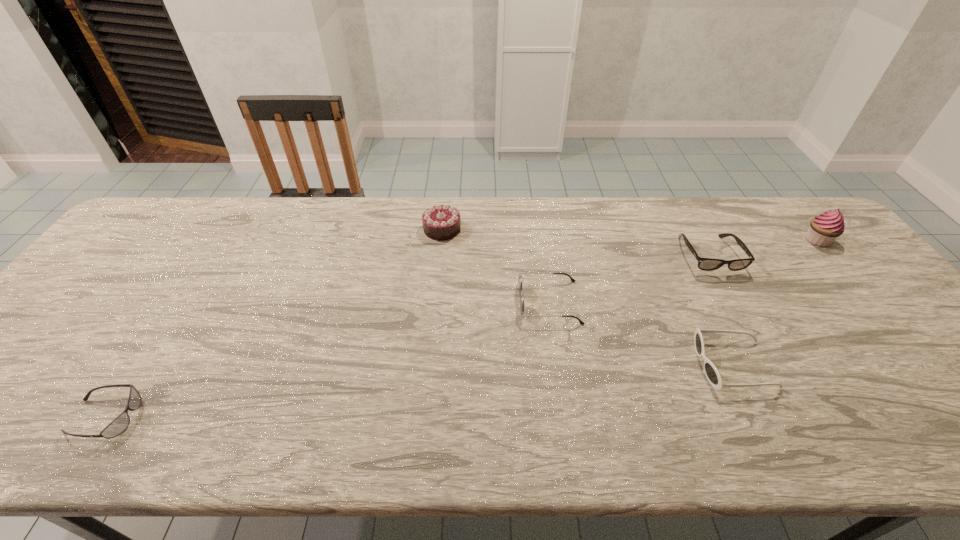
The width and height of the screenshot is (960, 540). In order to click on cupcake in this screenshot , I will do `click(824, 229)`.

What are the coordinates of `the tallest object` in the screenshot? It's located at (824, 229).

The width and height of the screenshot is (960, 540). Identify the location of the second tallest object. (441, 222).

Find the location of a particular element. The width and height of the screenshot is (960, 540). chocolate cake is located at coordinates (441, 222).

I want to click on spectacles, so click(707, 264).

At what (x,y) coordinates should I click in order to perform the action: click on the farthest sunglasses. Please return your answer as a coordinate pair (x, y). This screenshot has width=960, height=540. Looking at the image, I should click on point(522,298).

Where is `the second sunglasses from left to right`? the second sunglasses from left to right is located at coordinates (522, 298).

Find the location of `the rightmost sunglasses`. the rightmost sunglasses is located at coordinates (x=711, y=372).

Find the location of `the leftmost object`. the leftmost object is located at coordinates (119, 424).

At what (x,y) coordinates should I click in order to perform the action: click on the shortest sunglasses. Please return your answer as a coordinate pair (x, y). The width and height of the screenshot is (960, 540). Looking at the image, I should click on (119, 424).